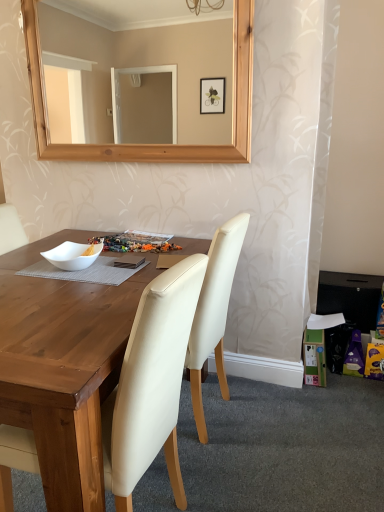
You are a GUI agent. You are given a task and a screenshot of the screen. Output one action in this format:
    pyautogui.click(x=<x>, y=<y>)
    Task: Click on the vacant area that lies in front of white matte bowl at center
    The width and height of the screenshot is (384, 512).
    Given the screenshot: What is the action you would take?
    pyautogui.click(x=65, y=285)